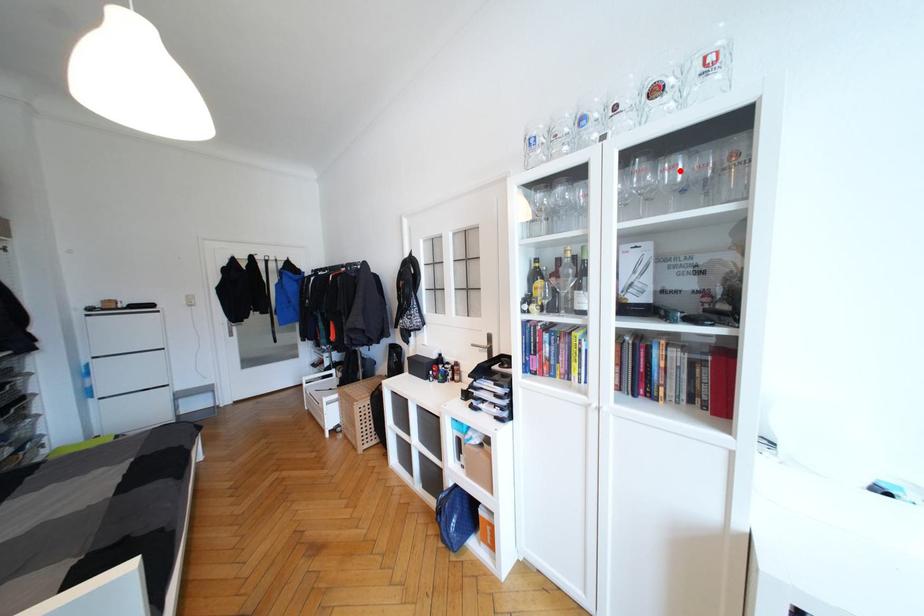
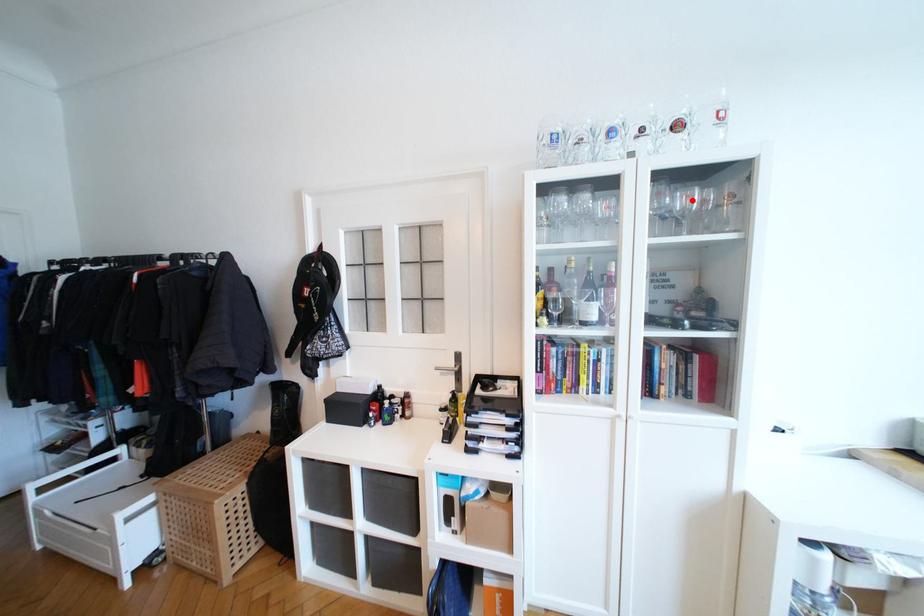
I am providing you with two images of the same scene from different viewpoints. A red point is marked on the first image and another point is marked on the second image. Are the points marked in image1 and image2 representing the same 3D position?

Yes